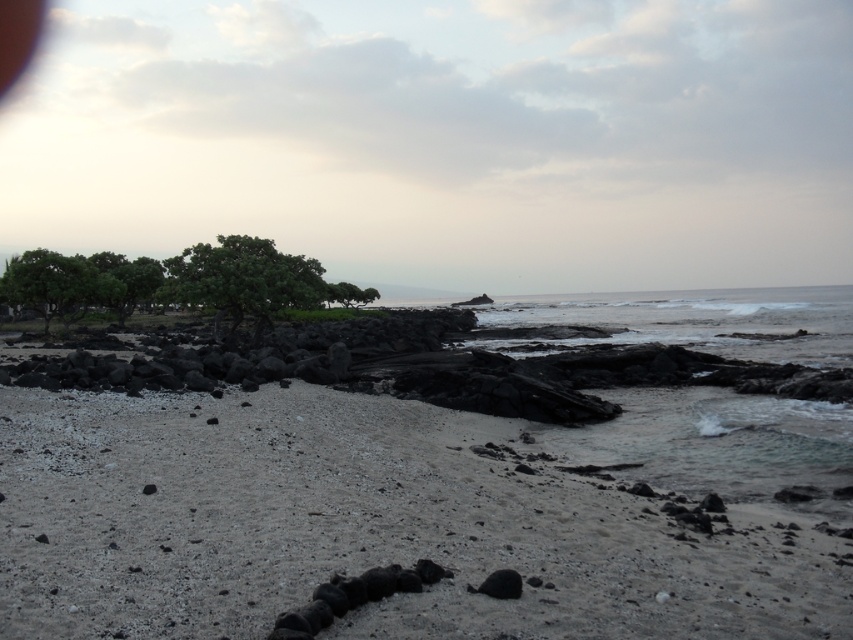
Is smooth sand beach at center positioned at the back of green leafy tree at upper left?

That is False.

Which of these two, smooth sand beach at center or green leafy tree at upper left, stands shorter?

smooth sand beach at center

Which is in front, point (6, 461) or point (24, 284)?

Point (6, 461) is more forward.

Identify the location of smooth sand beach at center. This screenshot has width=853, height=640. [415, 515].

Is smooth sand beach at center smaller than green leafy trees at left?

Incorrect, smooth sand beach at center is not smaller in size than green leafy trees at left.

Is smooth sand beach at center wider than green leafy trees at left?

Indeed, smooth sand beach at center has a greater width compared to green leafy trees at left.

Does point (527, 433) come farther from viewer compared to point (151, 280)?

No.

This screenshot has width=853, height=640. I want to click on smooth sand beach at center, so (415, 515).

Who is higher up, green leafy trees at left or green leafy tree at upper left?

green leafy trees at left is higher up.

Does green leafy trees at left have a greater width compared to green leafy tree at upper left?

Yes.

Measure the distance between green leafy trees at left and camera.

green leafy trees at left and camera are 28.75 meters apart from each other.

Identify the location of green leafy trees at left. The image size is (853, 640). (175, 282).